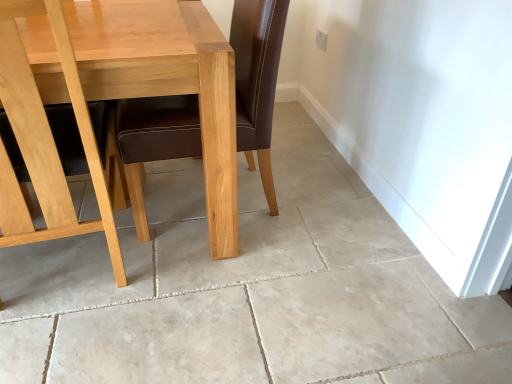
The width and height of the screenshot is (512, 384). Find the location of `space that is in front of light brown wood chair at left`. space that is in front of light brown wood chair at left is located at coordinates (77, 345).